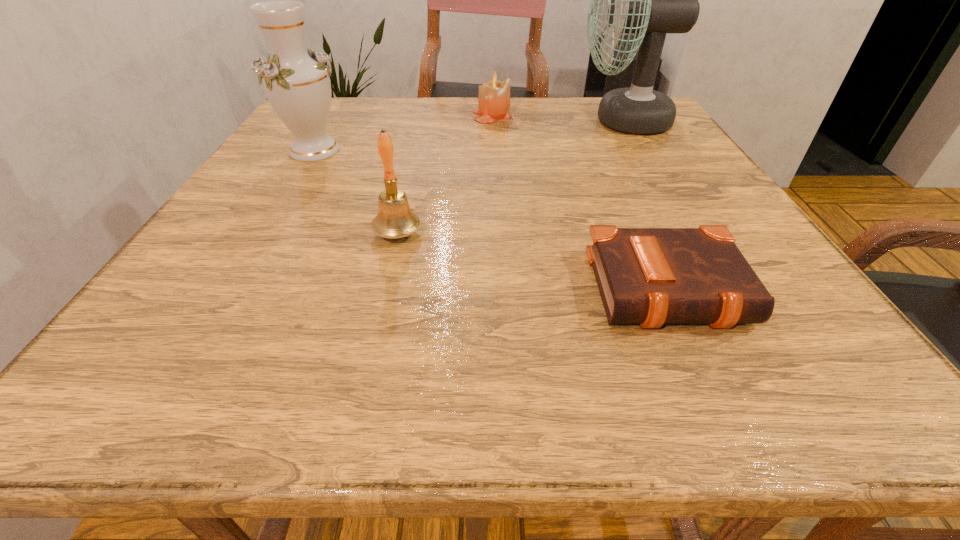
Find the location of a particular element. the tallest object is located at coordinates (649, 0).

You are a GUI agent. You are given a task and a screenshot of the screen. Output one action in this format:
    pyautogui.click(x=<x>, y=<y>)
    Task: Click on the vase
    Image resolution: width=960 pixels, height=540 pixels.
    Given the screenshot: What is the action you would take?
    pyautogui.click(x=296, y=81)

This screenshot has width=960, height=540. In order to click on the leftmost object in this screenshot , I will do pyautogui.click(x=296, y=81).

Where is `the second nearest object`? This screenshot has height=540, width=960. the second nearest object is located at coordinates (395, 219).

Locate an element on the screen. bell is located at coordinates (395, 219).

You are a GUI agent. You are given a task and a screenshot of the screen. Output one action in this format:
    pyautogui.click(x=<x>, y=<y>)
    Task: Click on the third object from left to right
    This screenshot has width=960, height=540.
    Given the screenshot: What is the action you would take?
    click(494, 96)

This screenshot has height=540, width=960. I want to click on the second shortest object, so click(494, 96).

Identify the location of the shortest object. The image size is (960, 540). (648, 276).

You are a GUI agent. You are given a task and a screenshot of the screen. Output one action in this format:
    pyautogui.click(x=<x>, y=<y>)
    Task: Click on the Bible
    
    Given the screenshot: What is the action you would take?
    pyautogui.click(x=648, y=276)

Locate an element on the screen. blank space located in front of the tallest object where the airflow is directed is located at coordinates (437, 121).